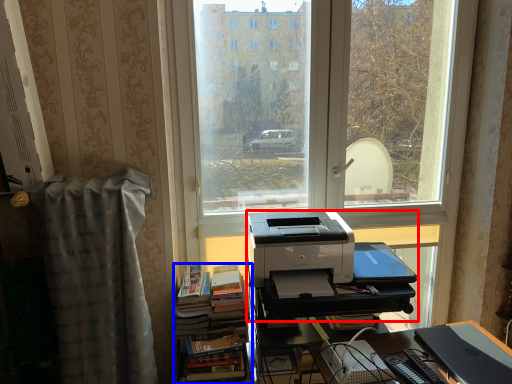
Question: Which of the following is the farthest to the observer, printer (highlighted by a red box) or book (highlighted by a blue box)?

Choices:
 (A) printer
 (B) book

Answer: (B)